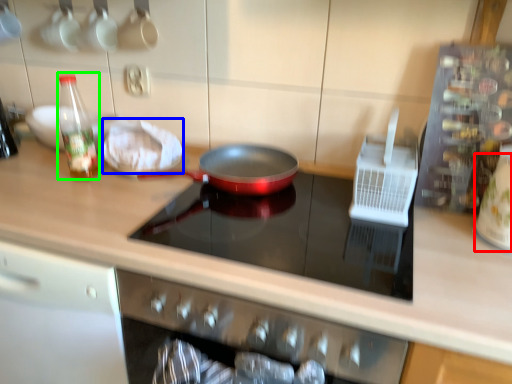
Question: Which is nearer to the appliance (highlighted by a red box)? food (highlighted by a blue box) or bottle (highlighted by a green box).

Choices:
 (A) food
 (B) bottle

Answer: (A)